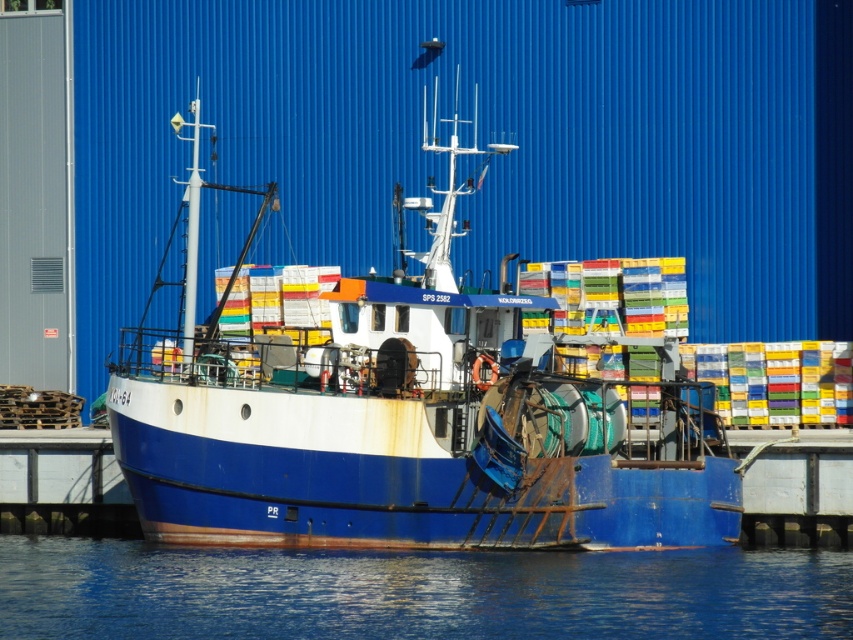
Question: Is blue matte boat at center in front of blue water at lower center?

Choices:
 (A) no
 (B) yes

Answer: (A)

Question: Where is blue matte boat at center located in relation to blue water at lower center in the image?

Choices:
 (A) right
 (B) left

Answer: (B)

Question: Which point is closer to the camera?

Choices:
 (A) blue matte boat at center
 (B) blue water at lower center

Answer: (B)

Question: Which object is farther from the camera taking this photo?

Choices:
 (A) blue matte boat at center
 (B) blue water at lower center

Answer: (A)

Question: Can you confirm if blue matte boat at center is positioned above blue water at lower center?

Choices:
 (A) yes
 (B) no

Answer: (A)